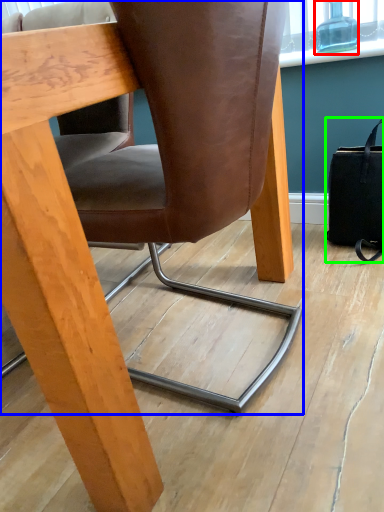
Question: Estimate the real-world distances between objects in this image. Which object is closer to bottle (highlighted by a red box), chair (highlighted by a blue box) or handbag (highlighted by a green box)?

Choices:
 (A) chair
 (B) handbag

Answer: (B)